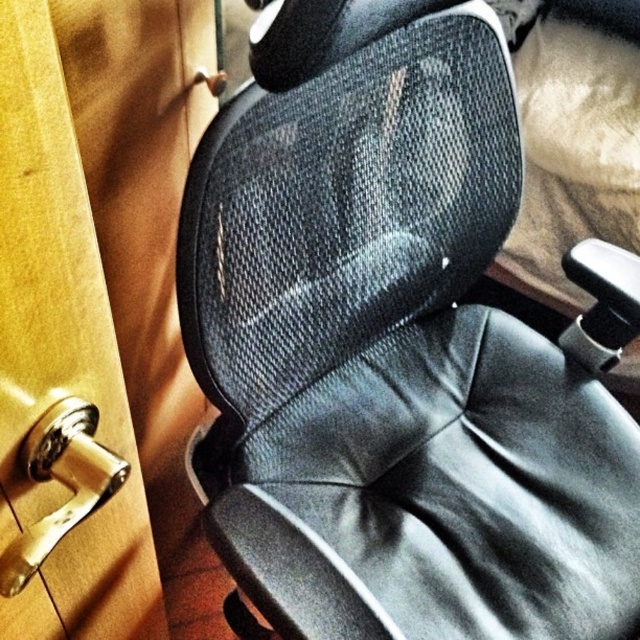
You are standing in an office and need to locate the exact spot where a maintenance worker previously made a repair. The repair location is marked by a small dot at point coordinates. Can you determine which object the point at coordinates (x=401, y=360) is located on?

The point at coordinates (x=401, y=360) is on the black mesh swivel chair at center, so the repair was made on that object.

You are standing in an office and need to exit through the door. The door has a polished brass door handle at lower left. There is also a black mesh swivel chair at center. Which object is closer to the door?

The polished brass door handle at lower left is closer to the door since the black mesh swivel chair at center is positioned on the right side of it.